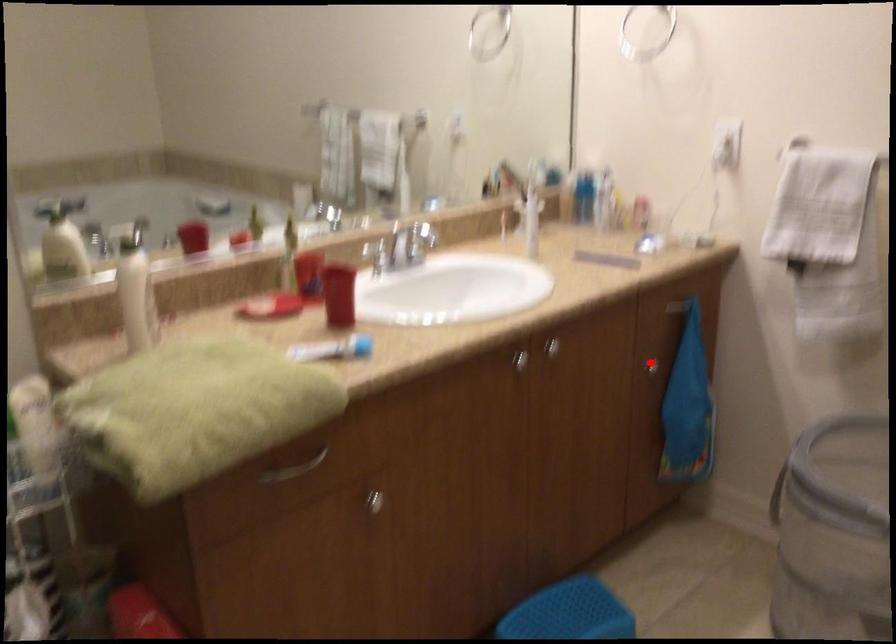
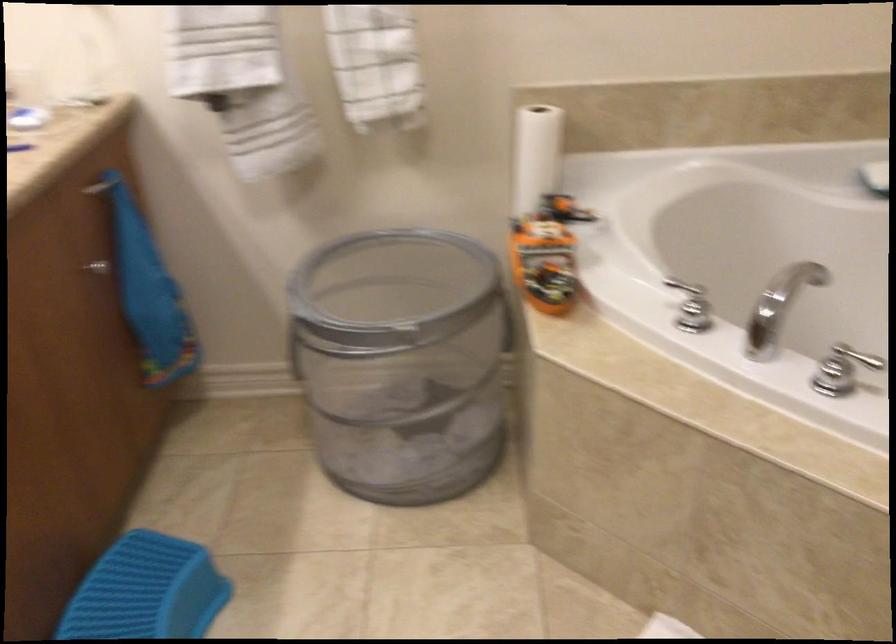
The point at the highlighted location is marked in the first image. Where is the corresponding point in the second image?

(97, 267)